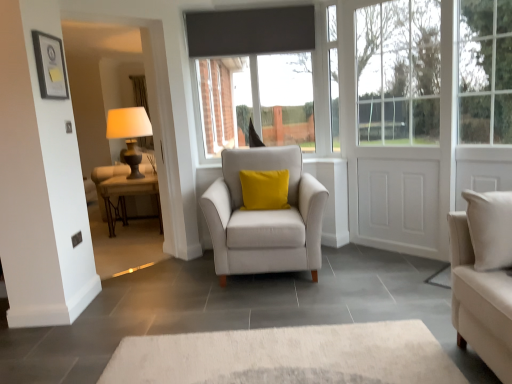
Question: From the image's perspective, is white plastic window frame at upper right positioned above or below matte black picture frame at upper left?

Choices:
 (A) below
 (B) above

Answer: (B)

Question: Is point (334, 130) positioned closer to the camera than point (39, 91)?

Choices:
 (A) farther
 (B) closer

Answer: (A)

Question: Which object is positioned farthest from the light gray fabric armchair at center?

Choices:
 (A) matte black table at left
 (B) matte black picture frame at upper left
 (C) white plastic window frame at upper right
 (D) matte black table lamp at left
 (E) white matte door at right

Answer: (D)

Question: Which of these objects is positioned farthest from the light gray fabric armchair at center?

Choices:
 (A) white plastic window frame at upper right
 (B) matte black table lamp at left
 (C) matte black picture frame at upper left
 (D) matte black table at left
 (E) white matte door at right

Answer: (B)